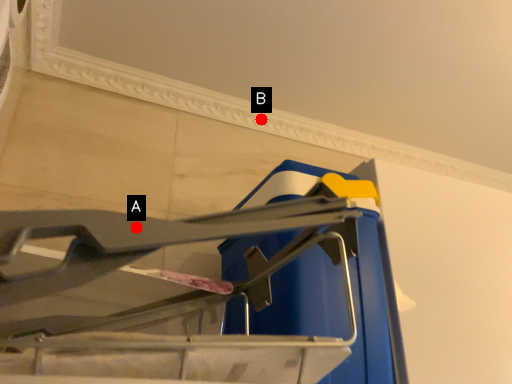
Question: Two points are circled on the image, labeled by A and B beside each circle. Which point is farther to the camera?

Choices:
 (A) A is further
 (B) B is further

Answer: (B)